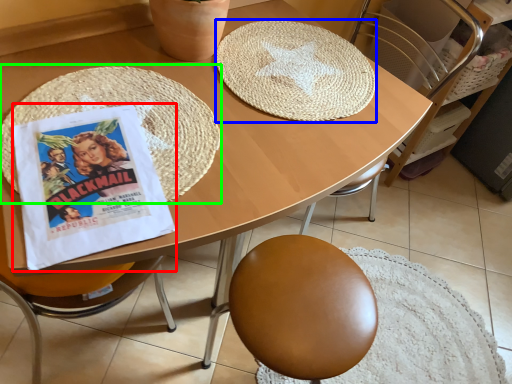
Question: Which object is positioned closest to comic book (highlighted by a red box)? Select from mat (highlighted by a blue box) and mat (highlighted by a green box).

Choices:
 (A) mat
 (B) mat

Answer: (B)